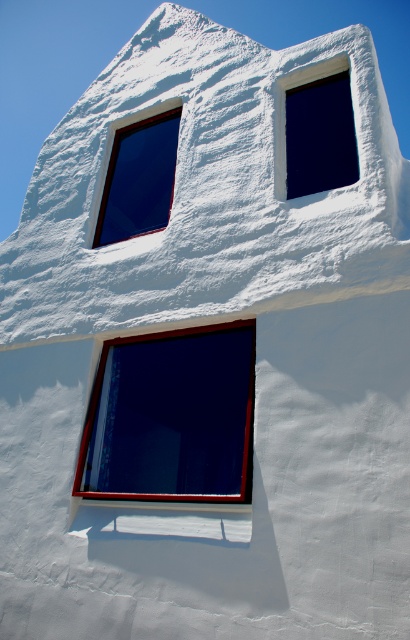
You are an architect designing a new building inspired by this style. You need to ensure that the central matte black window at center is proportionally larger than the matte glass window at upper left. Based on the image, does the current design meet this requirement?

Yes, the matte black window at center is bigger than the matte glass window at upper left, so it meets the requirement.

You are an architect reviewing the building facade. You notice the matte black window at center and the matte glass window at upper left. Which window is positioned lower on the building?

The matte black window at center is positioned lower on the building than the matte glass window at upper left.

You are an architect designing a new building inspired by this style. You want to ensure that the matte black window at center and the matte glass window at upper right maintain their visual balance. Given their sizes, which window should be placed higher to achieve this balance?

The matte black window at center is larger in size than the matte glass window at upper right, so to achieve visual balance, the smaller matte glass window at upper right should be placed higher to counterbalance the larger window below.